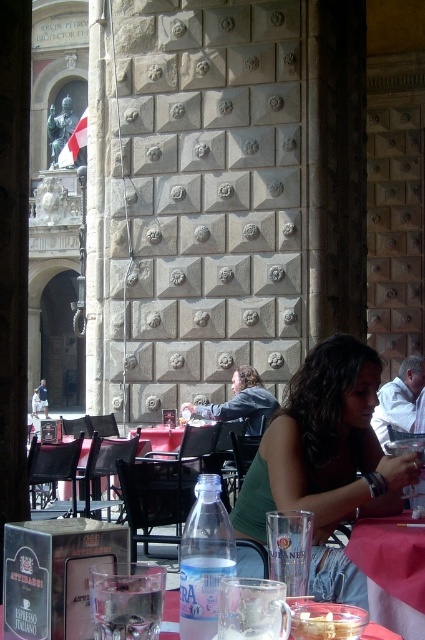
Question: Can you confirm if pink fabric tablecloth at lower right is positioned above translucent glass mug at lower center?

Choices:
 (A) no
 (B) yes

Answer: (A)

Question: Can you confirm if pink fabric tablecloth at lower right is smaller than translucent glass mug at lower center?

Choices:
 (A) no
 (B) yes

Answer: (A)

Question: Can you confirm if green fabric shirt at lower right is positioned above clear glass at lower center?

Choices:
 (A) no
 (B) yes

Answer: (A)

Question: Which point is closer to the camera?

Choices:
 (A) green fabric shirt at lower right
 (B) pink fabric tablecloth at lower right
 (C) clear glass at lower center
 (D) translucent glass mug at lower center

Answer: (C)

Question: Which object appears closest to the camera in this image?

Choices:
 (A) pink fabric tablecloth at lower right
 (B) clear glass at lower center
 (C) transparent plastic bottle at center

Answer: (B)

Question: Which point is farther from the camera taking this photo?

Choices:
 (A) (252, 637)
 (B) (342, 636)
 (C) (385, 612)

Answer: (C)